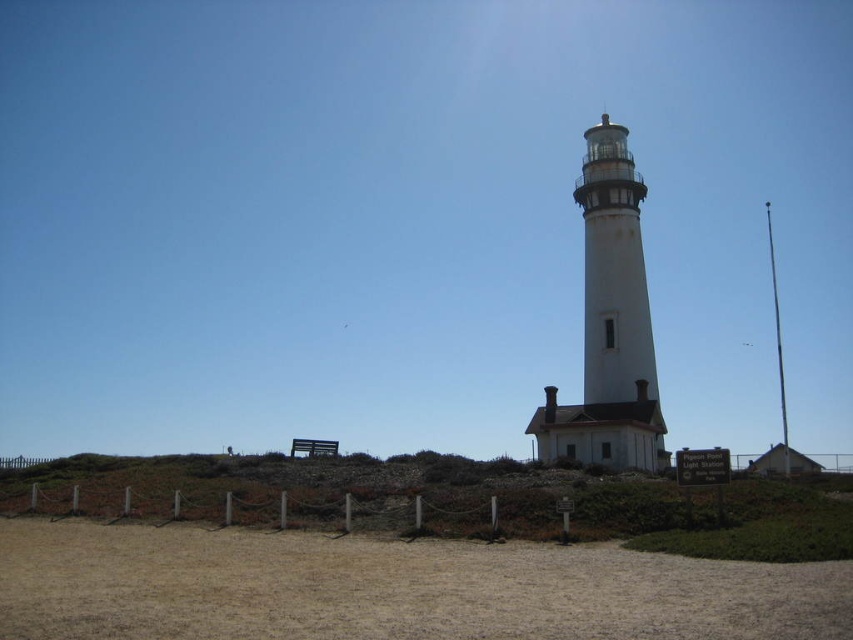
You are standing at the base of the white stone lighthouse at center and want to walk to the brown sandy ground at lower center. Which direction should you move in relation to the lighthouse?

The brown sandy ground at lower center is below the white stone lighthouse at center, so you should move downward towards the base of the white stone lighthouse at center to reach the brown sandy ground at lower center.

You are standing on the brown sandy ground at lower center and want to reach the white stone lighthouse at center. Which direction should you move in relative to the lighthouse?

Since the brown sandy ground at lower center is to the left of the white stone lighthouse at center, you should move to the right to reach the lighthouse.